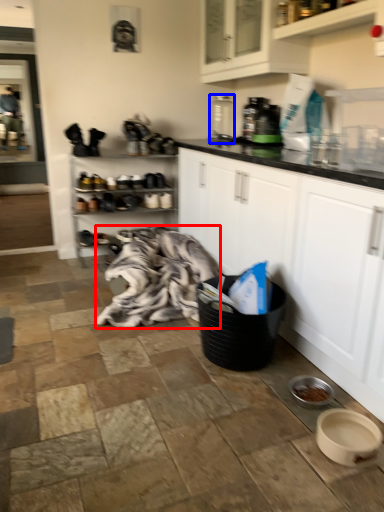
Question: Which object appears closest to the camera in this image, blanket (highlighted by a red box) or appliance (highlighted by a blue box)?

Choices:
 (A) blanket
 (B) appliance

Answer: (A)